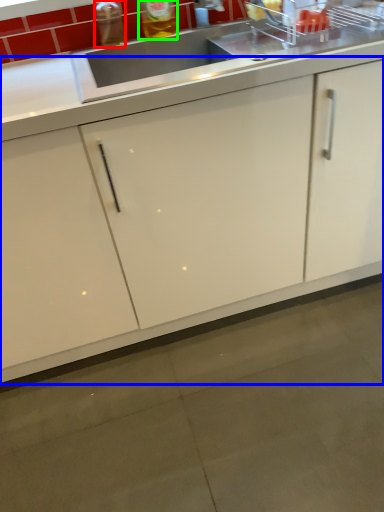
Question: Considering the real-world distances, which object is farthest from bottle (highlighted by a red box)? cabinetry (highlighted by a blue box) or beverage (highlighted by a green box)?

Choices:
 (A) cabinetry
 (B) beverage

Answer: (A)